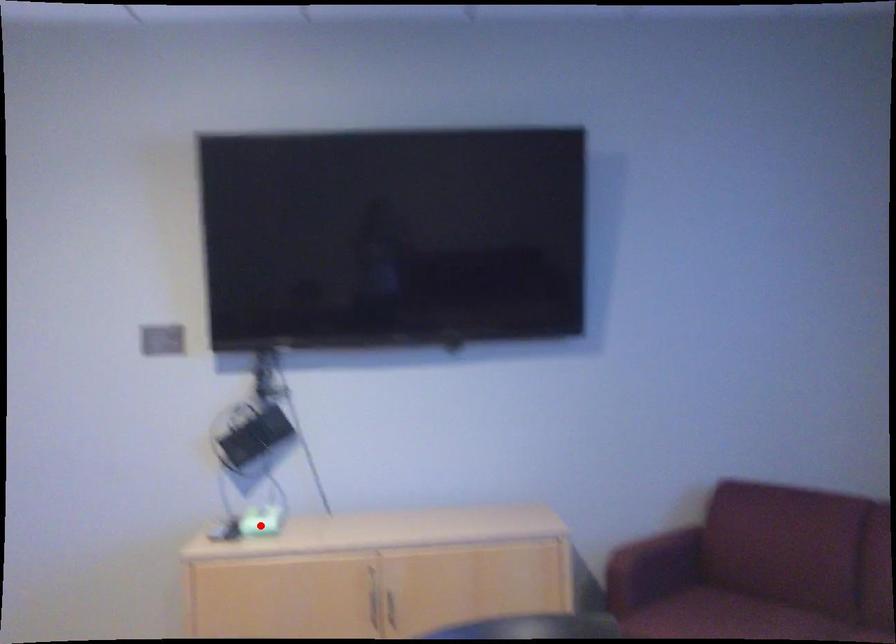
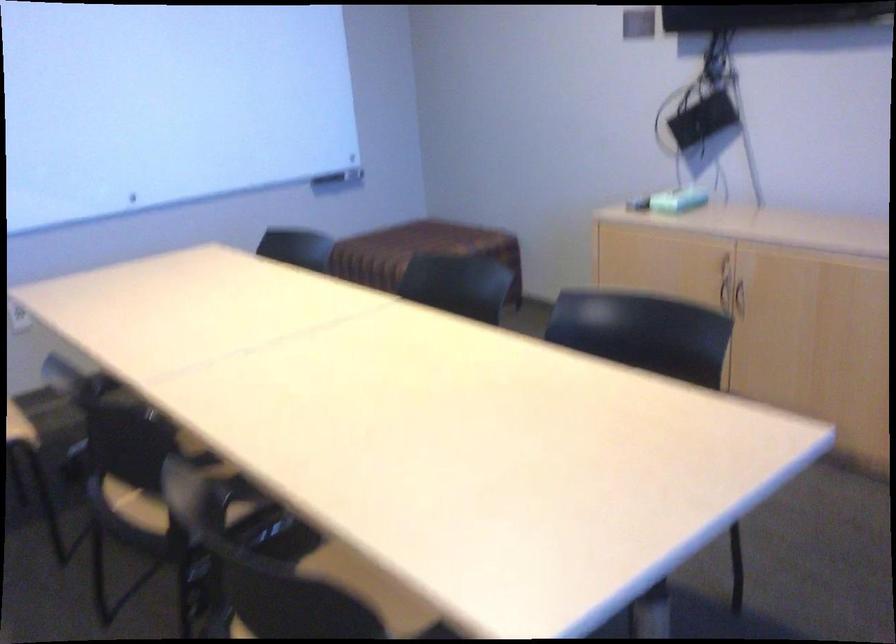
Question: A red point is marked in image1. In image2, is the corresponding 3D point closer to the camera or farther? Reply with the corresponding letter.

Choices:
 (A) The corresponding 3D point is closer.
 (B) The corresponding 3D point is farther.

Answer: (B)